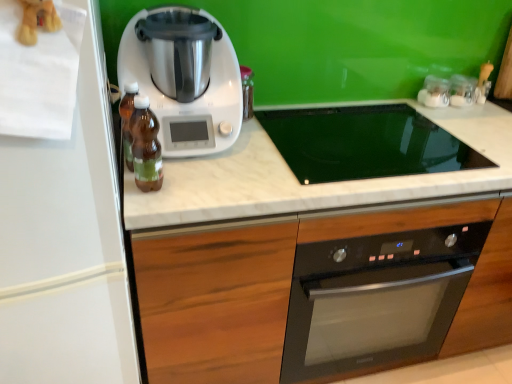
At what (x,y) coordinates should I click in order to perform the action: click on free space to the back side of brown glass bottle at center, the first bottle when ordered from front to back. Please return your answer as a coordinate pair (x, y). Looking at the image, I should click on (186, 168).